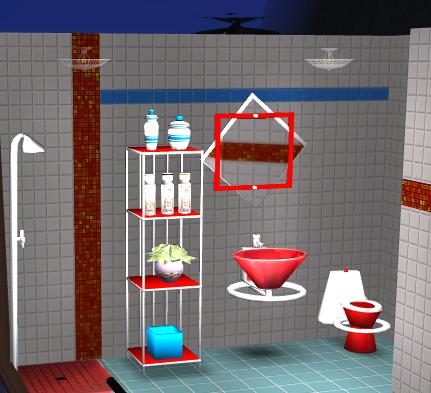
Where is `box`? Image resolution: width=431 pixels, height=393 pixels. box is located at coordinates (155, 333).